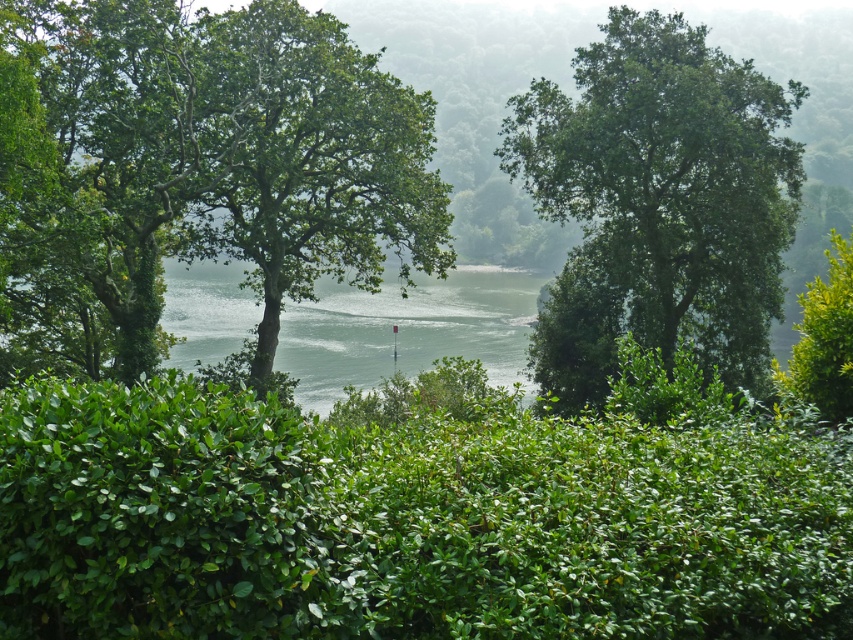
Question: Can you confirm if green leafy hedge at center is positioned to the left of clear water at center?

Choices:
 (A) yes
 (B) no

Answer: (B)

Question: Estimate the real-world distances between objects in this image. Which object is farther from the green leafy hedge at center?

Choices:
 (A) green leafy tree at center
 (B) clear water at center

Answer: (B)

Question: Can you confirm if green leafy hedge at center is positioned above green leafy tree at upper center?

Choices:
 (A) no
 (B) yes

Answer: (A)

Question: Which is farther from the green leafy tree at center?

Choices:
 (A) green leafy tree at upper center
 (B) green leafy hedge at center
 (C) clear water at center

Answer: (C)

Question: Which object is positioned farthest from the green leafy hedge at center?

Choices:
 (A) green leafy tree at upper center
 (B) green leafy tree at center

Answer: (A)

Question: Is green leafy hedge at center positioned before clear water at center?

Choices:
 (A) yes
 (B) no

Answer: (A)